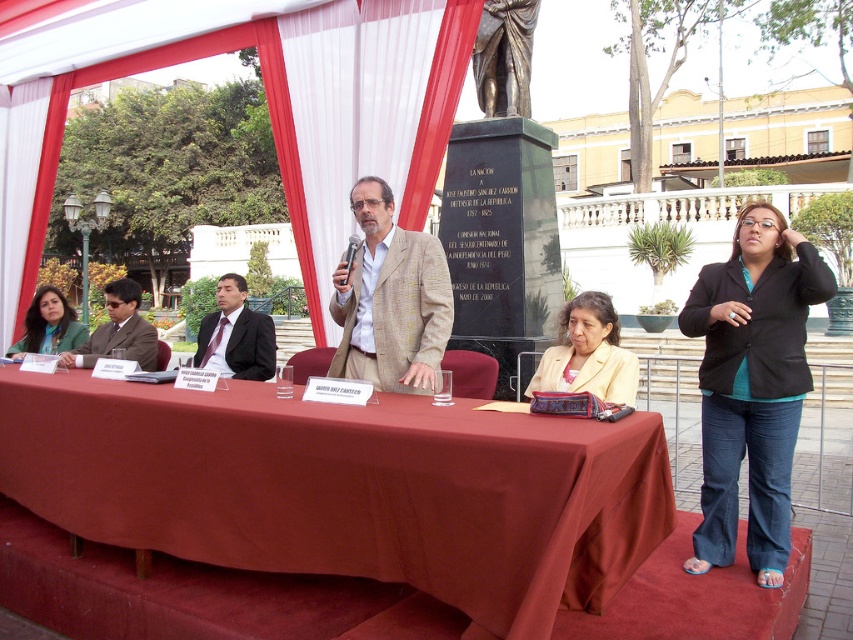
You are organizing a photo shoot and need to arrange two outfits on a table for a fashion spread. The outfits are the beige textured blazer at center and the matte brown suit at left. According to the scene, which outfit should you place on the smaller table section to ensure proper display?

The beige textured blazer at center has a smaller size compared to the matte brown suit at left, so it should be placed on the smaller table section to ensure proper display.